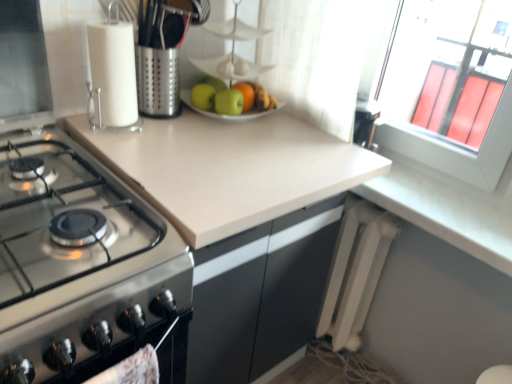
Find the location of a particular element. empty space that is ontop of beige laminate countertop at center (from a real-world perspective) is located at coordinates (229, 140).